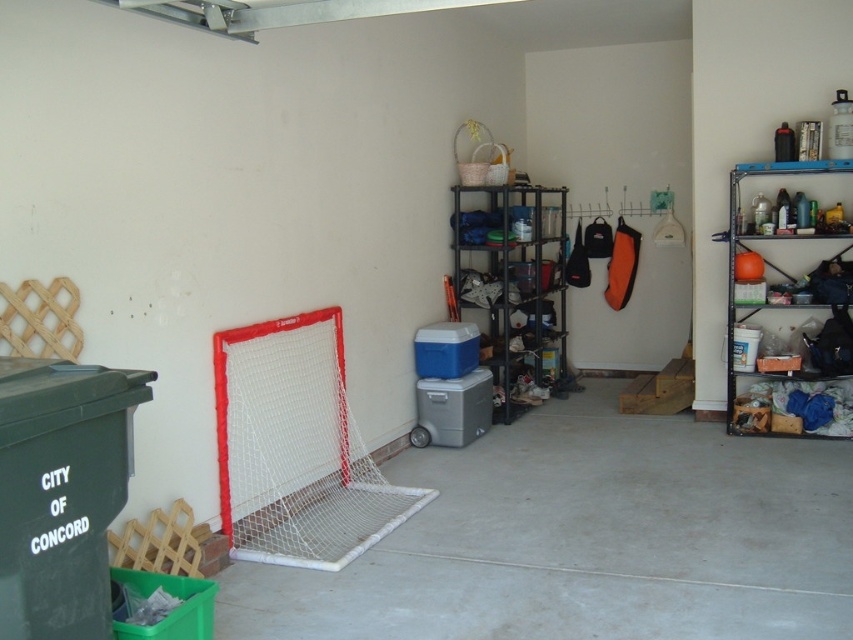
Question: Which is nearer to the metallic black shelving unit at center?

Choices:
 (A) green plastic cooler at lower left
 (B) orange matte sports ball at right

Answer: (B)

Question: From the image, what is the correct spatial relationship of white mesh net at left in relation to metallic black shelving unit at center?

Choices:
 (A) right
 (B) left

Answer: (B)

Question: Which point appears closest to the camera in this image?

Choices:
 (A) (488, 252)
 (B) (287, 362)
 (C) (12, 417)
 (D) (827, 413)

Answer: (C)

Question: Among these points, which one is farthest from the camera?

Choices:
 (A) (809, 337)
 (B) (25, 380)
 (C) (270, 470)
 (D) (500, 200)

Answer: (D)

Question: Is white mesh net at left thinner than green plastic cooler at lower left?

Choices:
 (A) yes
 (B) no

Answer: (B)

Question: Where is green plastic cooler at lower left located in relation to orange matte sports ball at right in the image?

Choices:
 (A) right
 (B) left

Answer: (B)